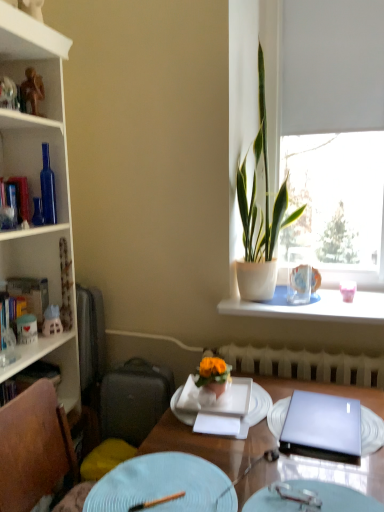
This screenshot has width=384, height=512. In order to click on free point above white glossy plate at center, which is the third plate from front to back (from a real-world perspective) in this screenshot , I will do `click(231, 400)`.